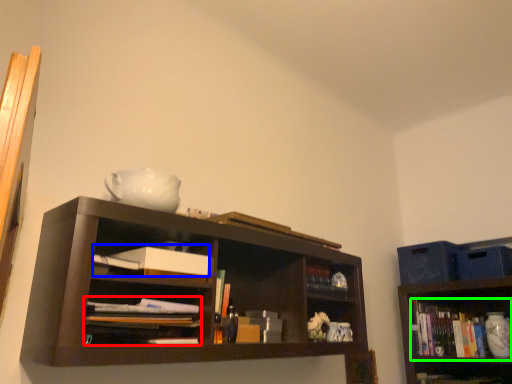
Question: Which object is positioned farthest from book (highlighted by a red box)? Select from paperback book (highlighted by a blue box) and book (highlighted by a green box).

Choices:
 (A) paperback book
 (B) book

Answer: (B)